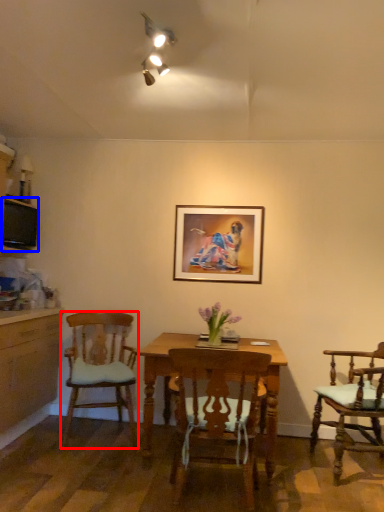
Question: Which point is further to the camera, chair (highlighted by a red box) or television (highlighted by a blue box)?

Choices:
 (A) chair
 (B) television

Answer: (B)